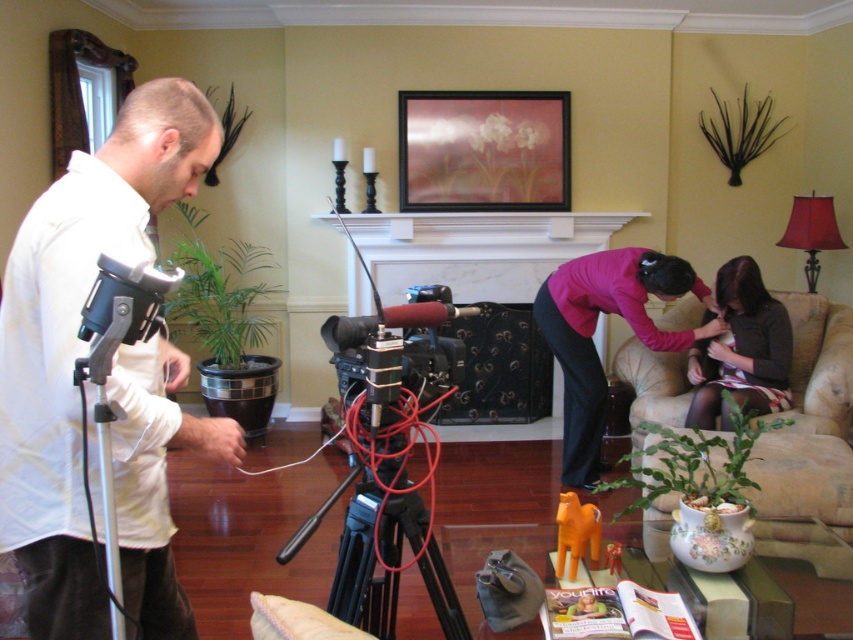
Question: Which point is closer to the camera taking this photo?

Choices:
 (A) (15, 438)
 (B) (416, 406)

Answer: (A)

Question: Estimate the real-world distances between objects in this image. Which object is closer to the metallic gold picture frame at upper center?

Choices:
 (A) pink fabric at center
 (B) matte black shirt at lower right

Answer: (A)

Question: Which is farther from the beige fabric armchair at lower right?

Choices:
 (A) black matte tripod at center
 (B) matte black shirt at lower right
 (C) black marble fireplace at center

Answer: (C)

Question: Does beige fabric armchair at lower right appear on the right side of black marble fireplace at center?

Choices:
 (A) no
 (B) yes

Answer: (B)

Question: Is black marble fireplace at center thinner than metallic gold picture frame at upper center?

Choices:
 (A) no
 (B) yes

Answer: (A)

Question: Is white matte tripod at left smaller than black marble fireplace at center?

Choices:
 (A) no
 (B) yes

Answer: (B)